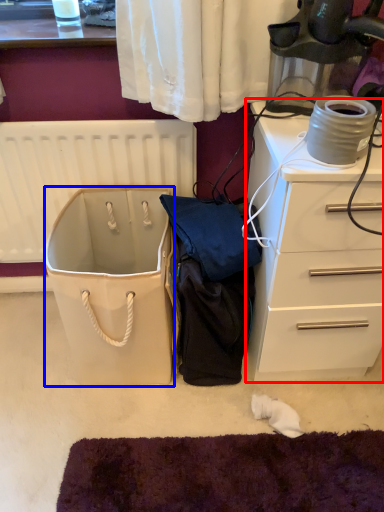
Question: Among these objects, which one is nearest to the camera, chest of drawers (highlighted by a red box) or wide (highlighted by a blue box)?

Choices:
 (A) chest of drawers
 (B) wide

Answer: (A)